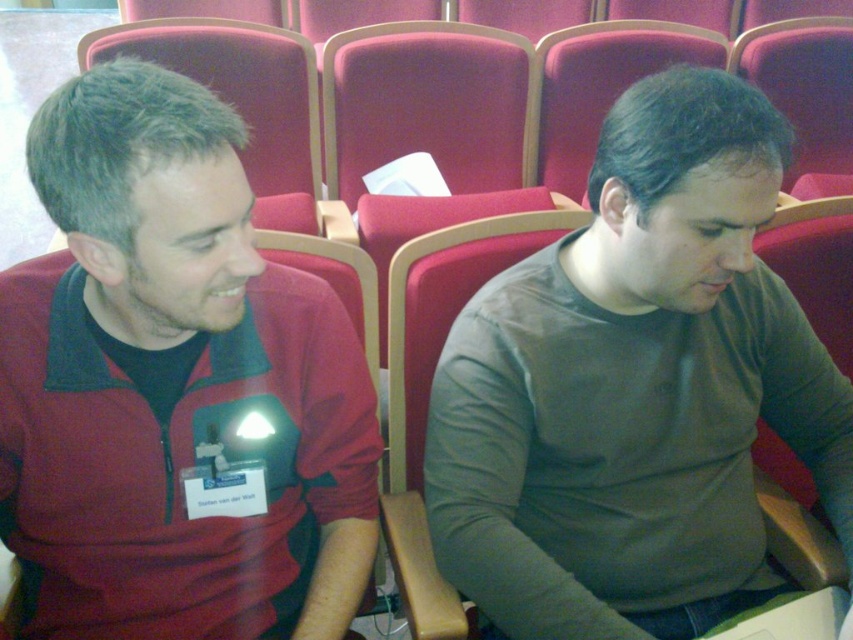
Question: Is the position of matte red jacket at left less distant than that of matte gray shirt at center?

Choices:
 (A) yes
 (B) no

Answer: (A)

Question: Does matte red jacket at left come in front of matte gray shirt at center?

Choices:
 (A) no
 (B) yes

Answer: (B)

Question: Which of the following is the closest to the observer?

Choices:
 (A) matte red jacket at left
 (B) matte gray shirt at center

Answer: (A)

Question: Is matte red jacket at left above matte gray shirt at center?

Choices:
 (A) no
 (B) yes

Answer: (B)

Question: Which point appears farthest from the camera in this image?

Choices:
 (A) (650, 444)
 (B) (22, 288)

Answer: (A)